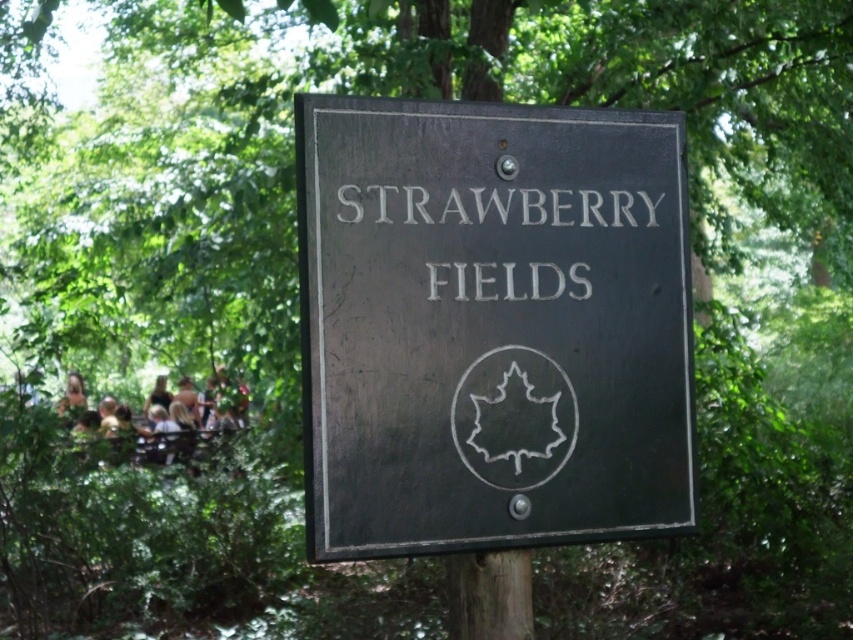
How distant is matte black sign at center from white painted text at center?

matte black sign at center and white painted text at center are 3.22 inches apart from each other.

In the scene shown: Between matte black sign at center and white painted text at center, which one is positioned higher?

white painted text at center

What do you see at coordinates (490, 324) in the screenshot? I see `matte black sign at center` at bounding box center [490, 324].

Find the location of a particular element. matte black sign at center is located at coordinates (490, 324).